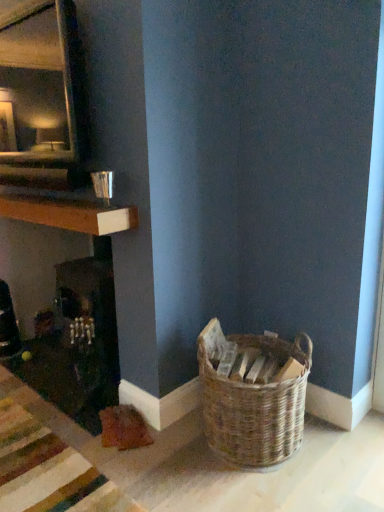
You are a GUI agent. You are given a task and a screenshot of the screen. Output one action in this format:
    pyautogui.click(x=<x>, y=<y>)
    Task: Click on the vacant space that is to the left of woven brown basket at lower right
    Image resolution: width=384 pixels, height=512 pixels.
    Given the screenshot: What is the action you would take?
    pyautogui.click(x=160, y=463)